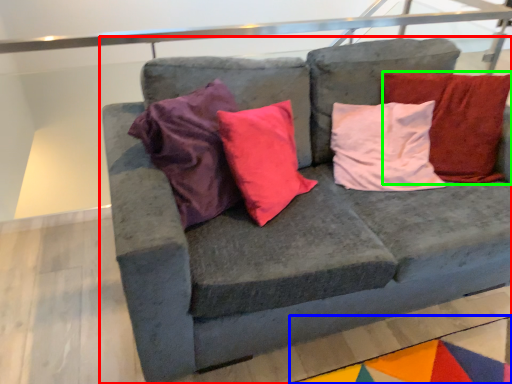
Question: Which is nearer to the studio couch (highlighted by a red box)? mat (highlighted by a blue box) or pillow (highlighted by a green box).

Choices:
 (A) mat
 (B) pillow

Answer: (B)